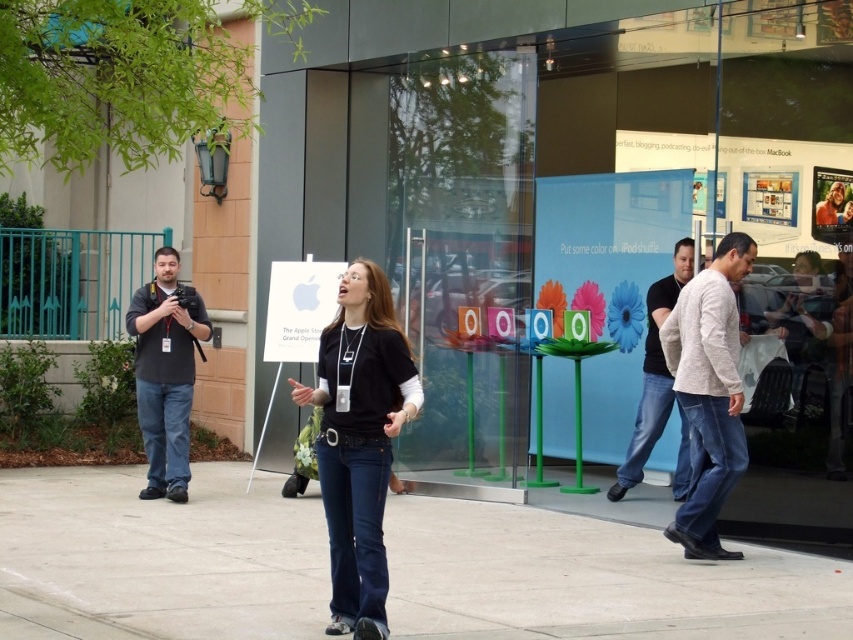
You are a photographer trying to capture a candid shot of the light gray sweater at right and the white paper at center. Which object should you focus on first to ensure both are in sharp focus?

You should focus on the light gray sweater at right first because it is closer to the viewer than the white paper at center, so adjusting focus from near to far will help both objects be in sharp focus.

You are an artist trying to sketch the scene. You notice the light gray sweater at right and the white paper at center. Which object should you draw first if you want to capture the one that takes up more space in the image?

The white paper at center takes up more space in the image because its width is greater than the light gray sweater at right.

You are a delivery person carrying a package that requires a 3.5 meter clearance to maneuver. You need to pass between the light gray sweater at right and the white paper at center. Can you fit through the space between them?

The distance between the light gray sweater at right and the white paper at center is 4.04 meters, which is wider than the required 3.5 meter clearance. Therefore, you can safely maneuver through the space between them.